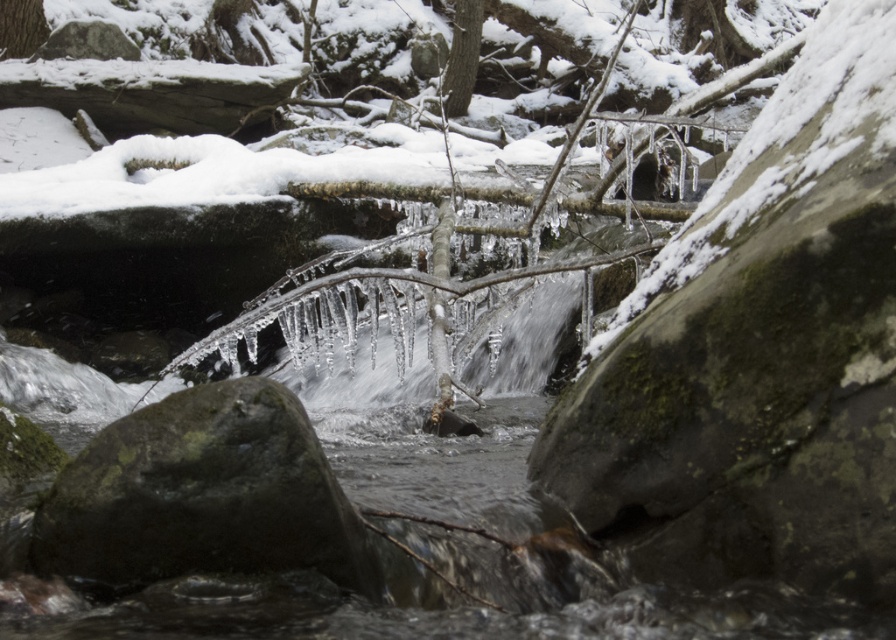
Is green mossy rock at center to the left of smooth bark tree at upper center from the viewer's perspective?

Yes, green mossy rock at center is to the left of smooth bark tree at upper center.

Does green mossy rock at center have a larger size compared to smooth bark tree at upper center?

No.

The height and width of the screenshot is (640, 896). What do you see at coordinates (203, 493) in the screenshot?
I see `green mossy rock at center` at bounding box center [203, 493].

Image resolution: width=896 pixels, height=640 pixels. Find the location of `green mossy rock at center`. green mossy rock at center is located at coordinates (203, 493).